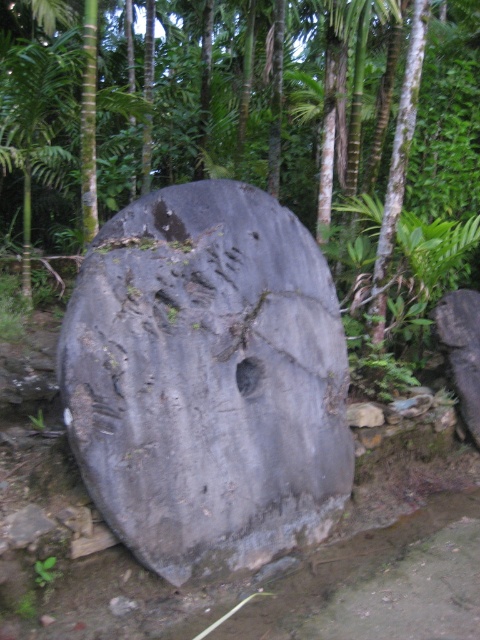
Is gray stone wheel at center further to camera compared to gray rough stone at center?

Yes, it is behind gray rough stone at center.

Is gray stone wheel at center to the right of gray rough stone at center from the viewer's perspective?

Correct, you'll find gray stone wheel at center to the right of gray rough stone at center.

Image resolution: width=480 pixels, height=640 pixels. Describe the element at coordinates (263, 134) in the screenshot. I see `gray stone wheel at center` at that location.

Identify the location of gray stone wheel at center. (263, 134).